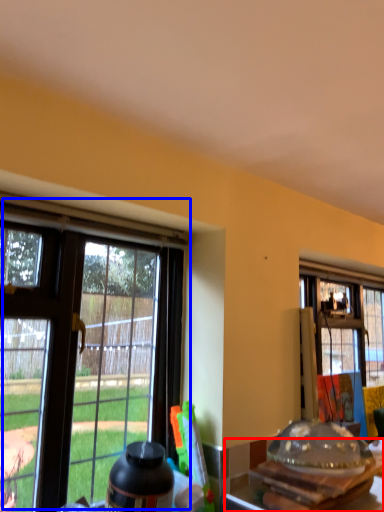
Question: Which object appears closest to the camera in this image, kitchen & dining room table (highlighted by a red box) or window (highlighted by a blue box)?

Choices:
 (A) kitchen & dining room table
 (B) window

Answer: (B)